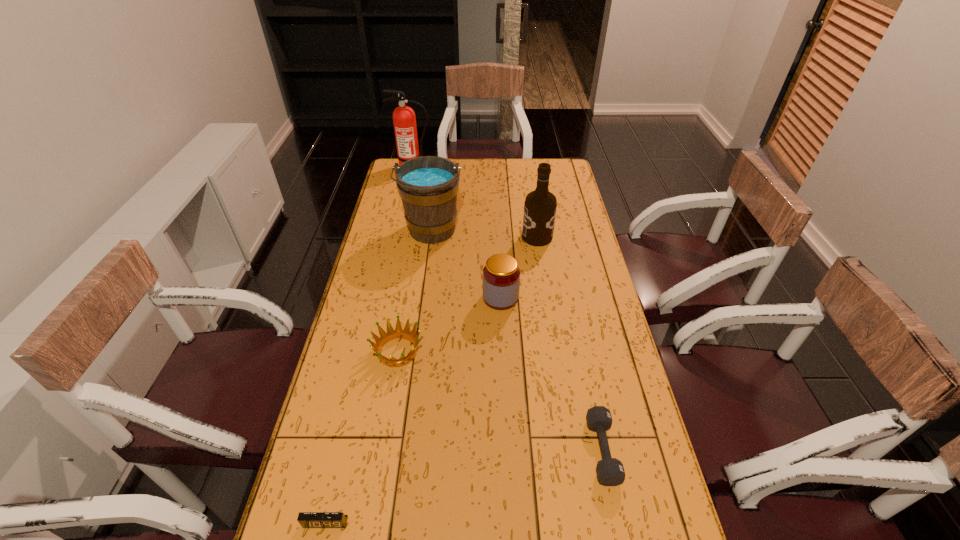
Locate an element on the screen. The width and height of the screenshot is (960, 540). vacant space at the right edge is located at coordinates (643, 515).

At what (x,y) coordinates should I click in order to perform the action: click on free space at the far right corner of the desktop. Please return your answer as a coordinate pair (x, y). This screenshot has height=540, width=960. Looking at the image, I should click on (568, 166).

I want to click on free space that is in between the crown and the farthest object, so click(x=405, y=259).

This screenshot has width=960, height=540. In order to click on free point between the dumbbell and the fifth tallest object in this screenshot , I will do `click(500, 401)`.

This screenshot has height=540, width=960. In order to click on free space between the farthest object and the alcohol in this screenshot , I will do `click(475, 202)`.

The height and width of the screenshot is (540, 960). Find the location of `free space between the fourth nearest object and the crown`. free space between the fourth nearest object and the crown is located at coordinates (449, 325).

You are a GUI agent. You are given a task and a screenshot of the screen. Output one action in this format:
    pyautogui.click(x=<x>, y=<y>)
    Task: Click on the free spot between the alcohol and the dumbbell
    
    Given the screenshot: What is the action you would take?
    pyautogui.click(x=569, y=343)

The height and width of the screenshot is (540, 960). What are the coordinates of `free space between the third nearest object and the alcohol` in the screenshot? It's located at (468, 294).

The image size is (960, 540). What are the coordinates of `free space that is in between the crown and the second shortest object` in the screenshot? It's located at (500, 401).

Locate an element on the screen. The height and width of the screenshot is (540, 960). free space between the sixth tallest object and the third shortest object is located at coordinates (500, 401).